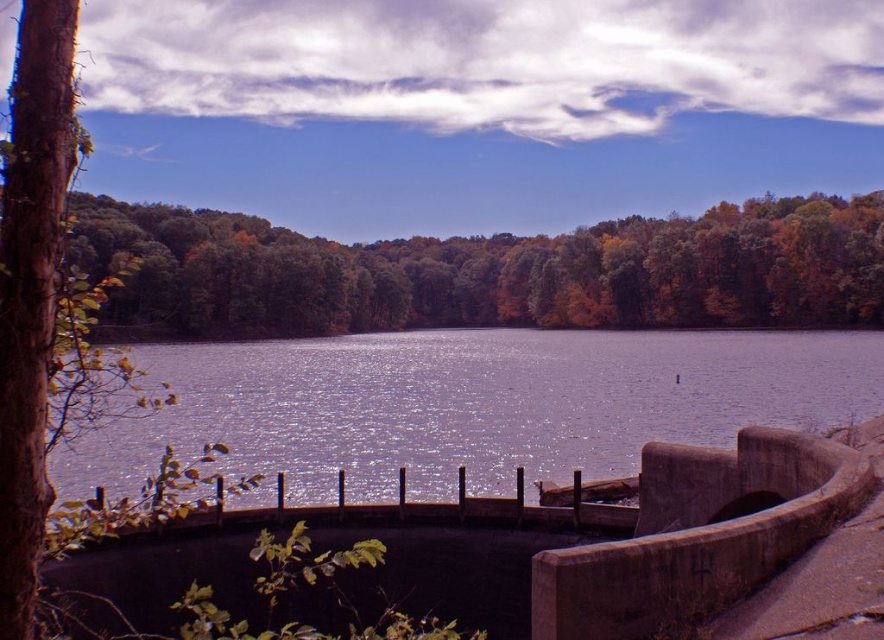
Question: Can you confirm if concrete dam at lower center is positioned to the left of glistening water at center?

Choices:
 (A) yes
 (B) no

Answer: (A)

Question: Is the position of concrete dam at lower center more distant than that of glistening water at center?

Choices:
 (A) no
 (B) yes

Answer: (A)

Question: Is concrete dam at lower center positioned behind glistening water at center?

Choices:
 (A) yes
 (B) no

Answer: (B)

Question: Which object appears closest to the camera in this image?

Choices:
 (A) green leafy trees at center
 (B) concrete dam at lower center

Answer: (B)

Question: Estimate the real-world distances between objects in this image. Which object is closer to the green leafy trees at center?

Choices:
 (A) glistening water at center
 (B) concrete dam at lower center

Answer: (A)

Question: Which of the following is the closest to the observer?

Choices:
 (A) (143, 292)
 (B) (410, 467)
 (C) (692, 595)

Answer: (C)